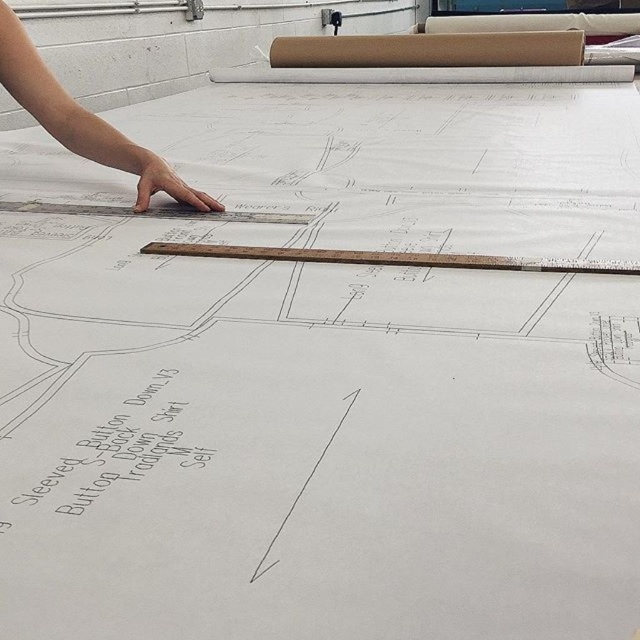
Question: Which of the following is the closest to the observer?

Choices:
 (A) wooden ruler at center
 (B) skinny hand at upper left

Answer: (A)

Question: Can you confirm if skinny hand at upper left is positioned to the right of wooden ruler at center?

Choices:
 (A) yes
 (B) no

Answer: (B)

Question: Among these objects, which one is nearest to the camera?

Choices:
 (A) wooden ruler at center
 (B) skinny hand at upper left

Answer: (A)

Question: Is skinny hand at upper left positioned at the back of wooden ruler at center?

Choices:
 (A) yes
 (B) no

Answer: (A)

Question: Which point is closer to the camera?

Choices:
 (A) skinny hand at upper left
 (B) wooden ruler at center

Answer: (B)

Question: Can you confirm if skinny hand at upper left is smaller than wooden ruler at center?

Choices:
 (A) no
 (B) yes

Answer: (A)